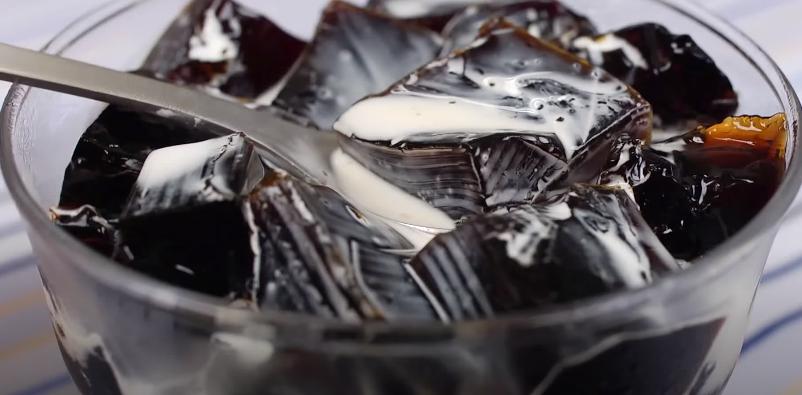
Locate an element on the screen. The width and height of the screenshot is (802, 395). rim of glass bowl is located at coordinates point(346,323).